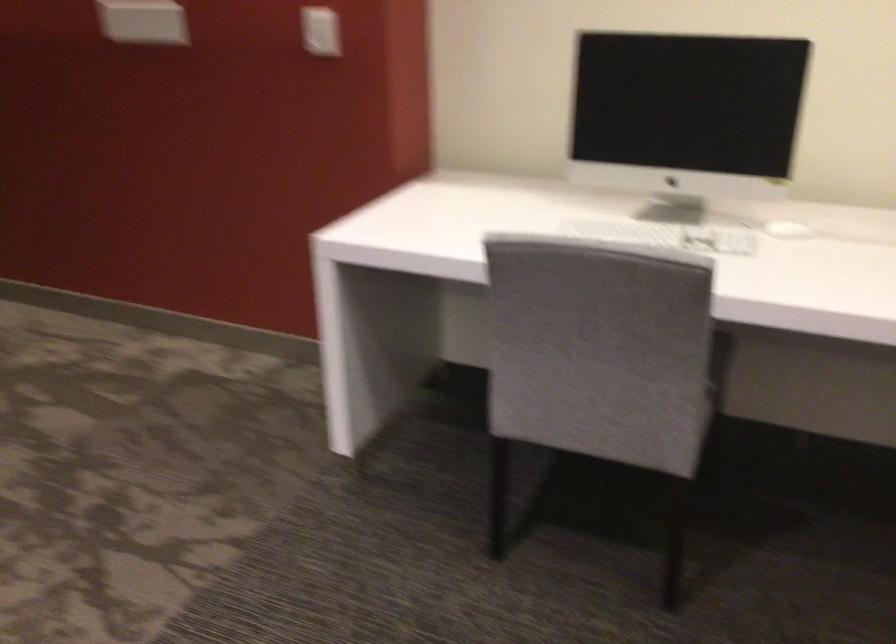
Where would you typ the white keyboard? Please return your answer as a coordinate pair (x, y).

(666, 234)